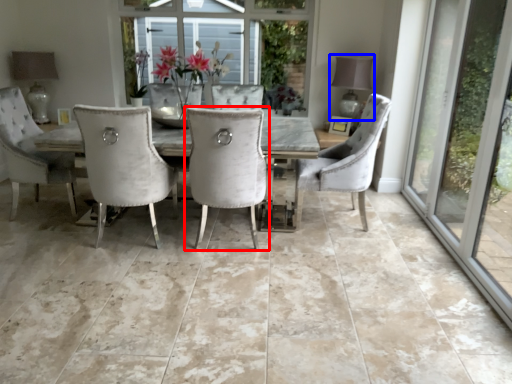
Question: Among these objects, which one is farthest to the camera, chair (highlighted by a red box) or lamp (highlighted by a blue box)?

Choices:
 (A) chair
 (B) lamp

Answer: (B)